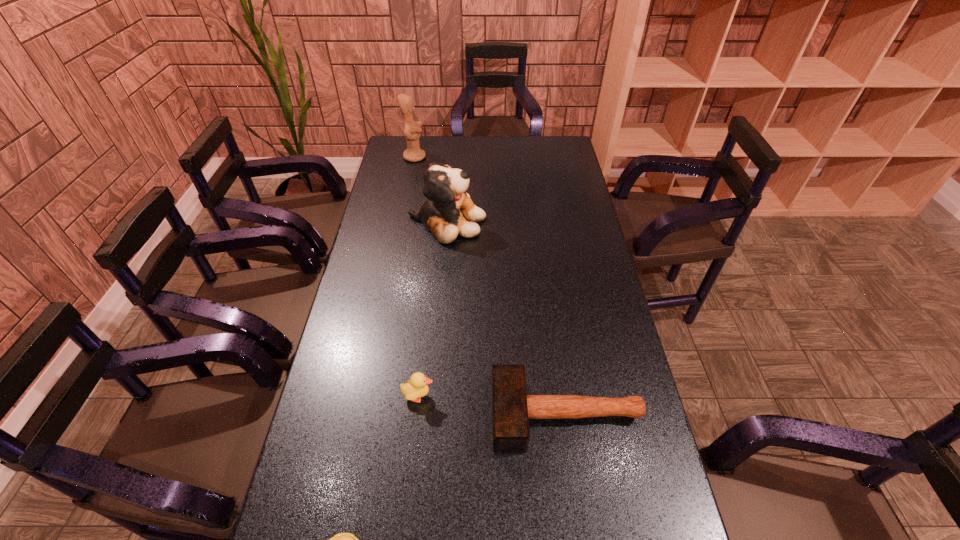
Locate an element on the screen. figurine is located at coordinates (413, 153).

Locate an element on the screen. the fourth shortest object is located at coordinates (444, 213).

Find the location of `the second farthest object`. the second farthest object is located at coordinates (444, 213).

The width and height of the screenshot is (960, 540). What are the coordinates of `the taller duckling` in the screenshot? It's located at (417, 387).

Identify the location of the right duckling. (417, 387).

This screenshot has width=960, height=540. In order to click on the rightmost object in this screenshot , I will do `click(512, 408)`.

Where is `free spot located 0.300m on the front-facing side of the figurine`? The width and height of the screenshot is (960, 540). free spot located 0.300m on the front-facing side of the figurine is located at coordinates (492, 157).

Image resolution: width=960 pixels, height=540 pixels. Find the location of `free spot located at the face of the second tallest object`. free spot located at the face of the second tallest object is located at coordinates (575, 221).

The height and width of the screenshot is (540, 960). Identify the location of free space located 0.090m on the front-facing side of the taller duckling. (468, 396).

The image size is (960, 540). What are the coordinates of `free space located on the hammer head face of the rightmost object` in the screenshot? It's located at (368, 415).